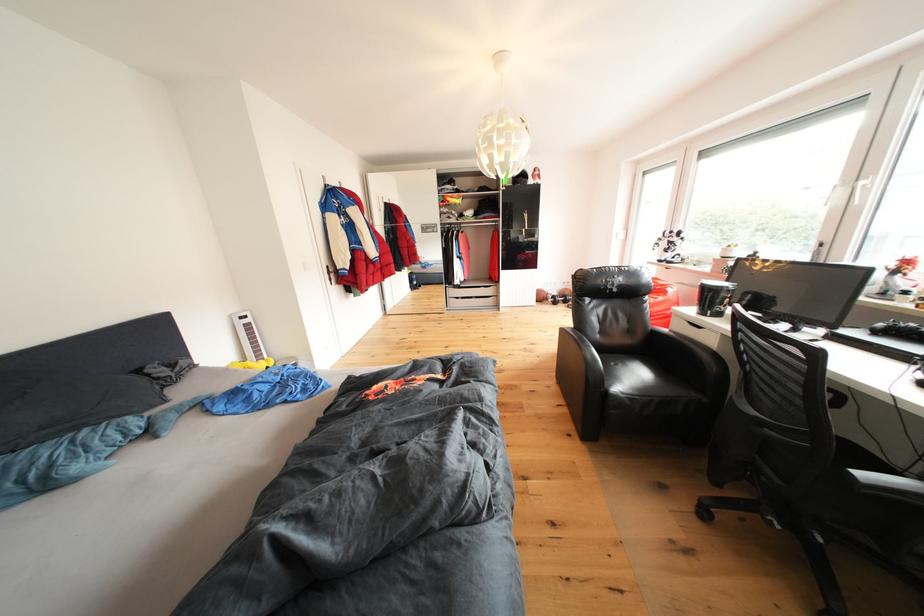
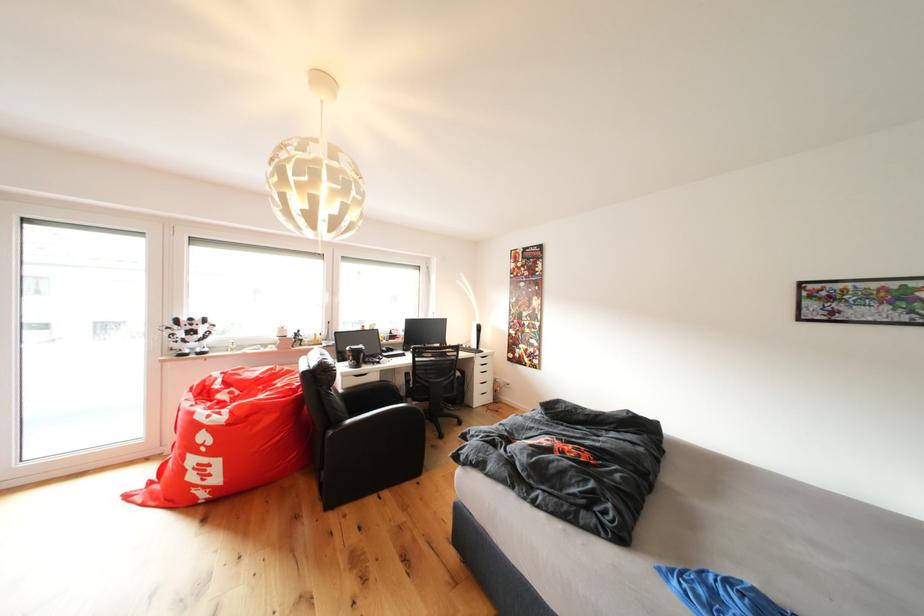
Question: I am providing you with two images of the same scene from different viewpoints. After the viewpoint changes to image2, which objects are now occluded?

Choices:
 (A) white robot figure
 (B) black tumbler cup
 (C) black patterned mug
 (D) brass door lock

Answer: (C)